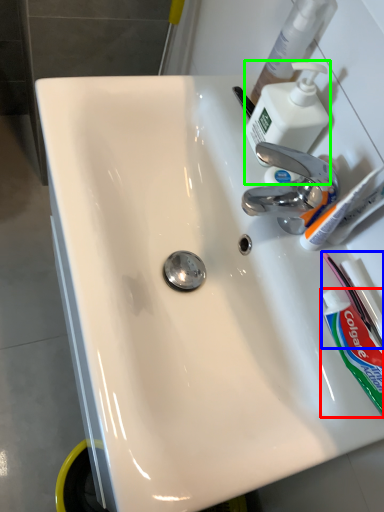
Question: Which is farther away from toothpaste (highlighted by a red box)? toothbrush (highlighted by a blue box) or soap dispenser (highlighted by a green box)?

Choices:
 (A) toothbrush
 (B) soap dispenser

Answer: (B)